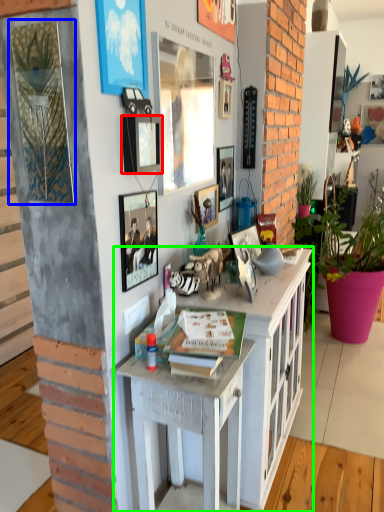
Question: Which object is positioned closest to picture frame (highlighted by a red box)? Select from picture frame (highlighted by a blue box) and cabinetry (highlighted by a green box).

Choices:
 (A) picture frame
 (B) cabinetry

Answer: (A)